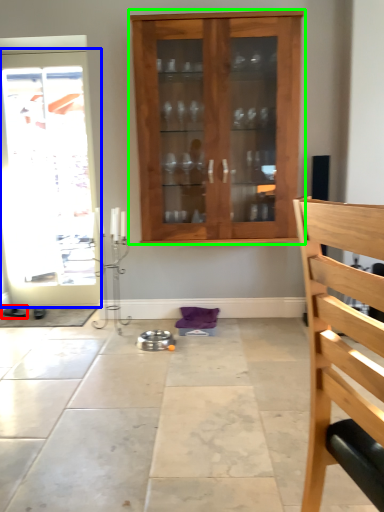
Question: Which is nearer to the footwear (highlighted by a red box)? door (highlighted by a blue box) or cabinetry (highlighted by a green box).

Choices:
 (A) door
 (B) cabinetry

Answer: (A)